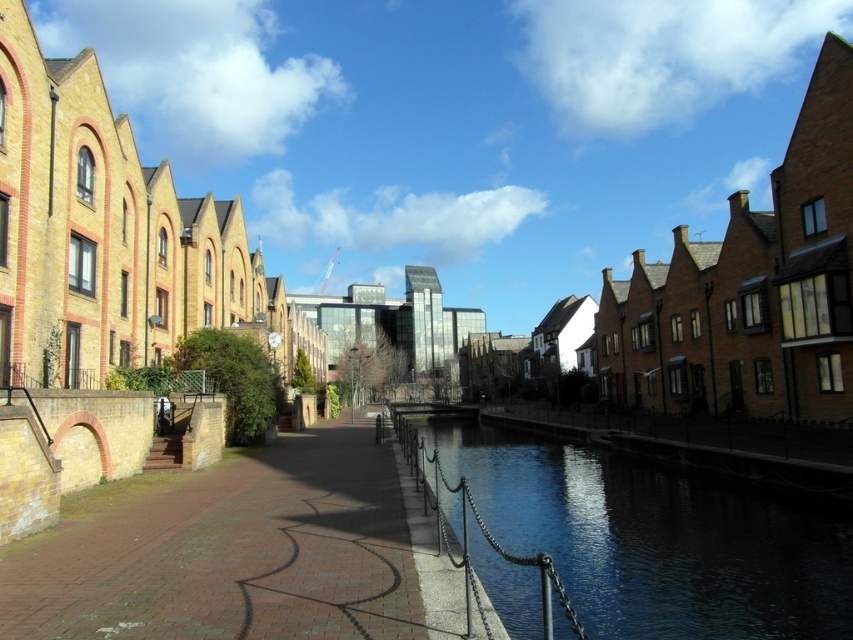
Question: Observing the image, what is the correct spatial positioning of brick pavement at center in reference to dark glassy water at center?

Choices:
 (A) left
 (B) right

Answer: (A)

Question: Is brick pavement at center above dark glassy water at center?

Choices:
 (A) no
 (B) yes

Answer: (B)

Question: Which object appears farthest from the camera in this image?

Choices:
 (A) dark glassy water at center
 (B) brick pavement at center

Answer: (B)

Question: Does brick pavement at center have a smaller size compared to dark glassy water at center?

Choices:
 (A) no
 (B) yes

Answer: (B)